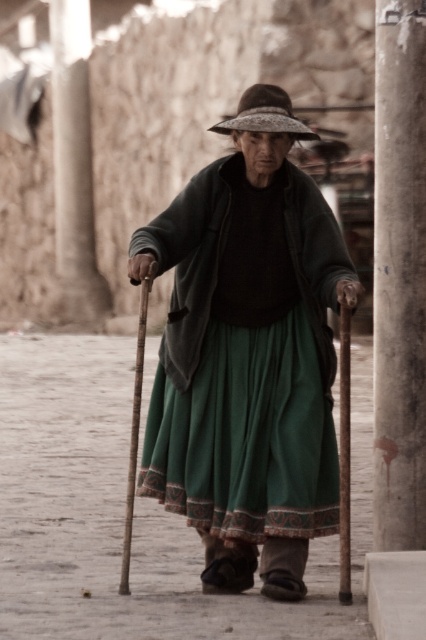
Question: Which of the following is the closest to the observer?

Choices:
 (A) (126, 531)
 (B) (342, 582)

Answer: (B)

Question: Which object appears closest to the camera in this image?

Choices:
 (A) brown straw hat at center
 (B) wooden cane at center

Answer: (B)

Question: Does smooth concrete pillar at right have a smaller size compared to brown straw hat at center?

Choices:
 (A) no
 (B) yes

Answer: (A)

Question: Which of the following is the closest to the observer?

Choices:
 (A) (388, 400)
 (B) (284, 108)
 (C) (137, 422)
 (D) (340, 429)

Answer: (D)

Question: Is dusty concrete pavement at center closer to the viewer compared to brown straw hat at center?

Choices:
 (A) no
 (B) yes

Answer: (B)

Question: Does green woven skirt at center have a smaller size compared to smooth concrete pillar at right?

Choices:
 (A) no
 (B) yes

Answer: (A)